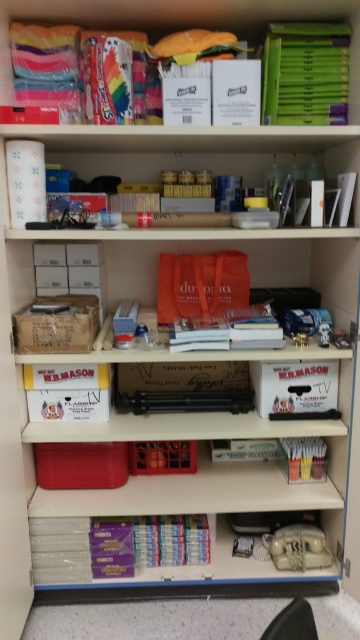
Question: Which point appears closest to the camera in this image?

Choices:
 (A) (114, 518)
 (B) (110, 163)
 (C) (327, 65)

Answer: (C)

Question: Can you confirm if white paper towel at upper center is positioned to the right of purple matte book at lower center?

Choices:
 (A) no
 (B) yes

Answer: (B)

Question: Which point is farther to the camera?

Choices:
 (A) (357, 20)
 (B) (194, 166)
 (C) (129, 548)
 (D) (326, 26)

Answer: (B)

Question: Does white paper towel at upper center have a greater width compared to green matte folder at upper right?

Choices:
 (A) yes
 (B) no

Answer: (A)

Question: Which of the following is the farthest from the observer?

Choices:
 (A) (253, 164)
 (B) (154, 540)
 (C) (331, 102)
 (D) (293, 109)

Answer: (A)

Question: Does matte plastic book at upper center appear on the left side of green matte folder at upper right?

Choices:
 (A) yes
 (B) no

Answer: (A)